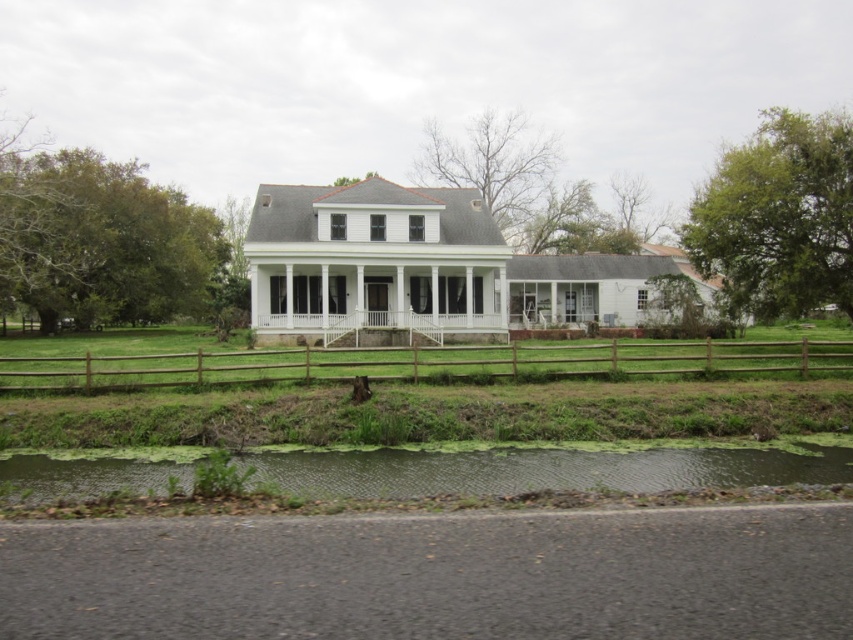
Question: Does green algae-covered pond at lower center lie in front of brown wooden fence at center?

Choices:
 (A) yes
 (B) no

Answer: (A)

Question: Which point appears closest to the camera in this image?

Choices:
 (A) (612, 490)
 (B) (640, 355)

Answer: (A)

Question: Is green algae-covered pond at lower center thinner than brown wooden fence at center?

Choices:
 (A) yes
 (B) no

Answer: (A)

Question: Which point is closer to the camera taking this photo?

Choices:
 (A) (660, 458)
 (B) (772, 346)

Answer: (A)

Question: Does green algae-covered pond at lower center appear under brown wooden fence at center?

Choices:
 (A) no
 (B) yes

Answer: (B)